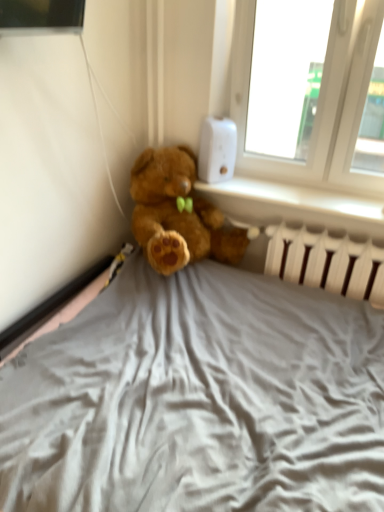
In order to face white plastic radiator at lower right, should I rotate leftwards or rightwards?

Rotate right and turn 17.614 degrees.

At what (x,y) coordinates should I click in order to perform the action: click on white plastic thermostat at upper right. Please return your answer as a coordinate pair (x, y). Looking at the image, I should click on (217, 150).

Is white plastic radiator at lower right beside white plastic thermostat at upper right?

No, white plastic radiator at lower right is not with white plastic thermostat at upper right.

Which of these two, white plastic radiator at lower right or white plastic thermostat at upper right, stands shorter?

white plastic thermostat at upper right.

Which object is positioned more to the left, white plastic radiator at lower right or white plastic thermostat at upper right?

Positioned to the left is white plastic thermostat at upper right.

Considering their positions, is white plastic radiator at lower right located in front of or behind white plastic thermostat at upper right?

Visually, white plastic radiator at lower right is located in front of white plastic thermostat at upper right.

From the image's perspective, who appears lower, white plastic thermostat at upper right or white plastic radiator at lower right?

white plastic radiator at lower right is shown below in the image.

From a real-world perspective, which is physically below, white plastic thermostat at upper right or white plastic radiator at lower right?

From a 3D spatial view, white plastic radiator at lower right is below.

Is white plastic thermostat at upper right next to white plastic radiator at lower right and touching it?

No, white plastic thermostat at upper right is not with white plastic radiator at lower right.

From a real-world perspective, is white plastic radiator at lower right positioned under white plastic radiator at lower right based on gravity?

Actually, white plastic radiator at lower right is physically above white plastic radiator at lower right in the real world.

From the picture: From the image's perspective, which object appears higher, white plastic radiator at lower right or white plastic radiator at lower right?

white plastic radiator at lower right is shown above in the image.

Which is in front, point (332, 194) or point (374, 293)?

The point (374, 293) is in front.

Is white plastic radiator at lower right facing away from white plastic radiator at lower right?

That's not correct — white plastic radiator at lower right is not looking away from white plastic radiator at lower right.

How much distance is there between white plastic radiator at lower right and white plastic radiator at lower right?

5.47 inches.

How many degrees apart are the facing directions of white plastic radiator at lower right and white plastic radiator at lower right?

There is a 0.000102-degree angle between the facing directions of white plastic radiator at lower right and white plastic radiator at lower right.

From a real-world perspective, is white plastic radiator at lower right above or below white plastic radiator at lower right?

white plastic radiator at lower right is situated lower than white plastic radiator at lower right in the real world.

Is white plastic radiator at lower right behind white plastic radiator at lower right?

No, the depth of white plastic radiator at lower right is less than that of white plastic radiator at lower right.

In order to click on window sill below the white plastic thermostat at upper right (from the image's perspective) in this screenshot , I will do `click(297, 207)`.

Is white plastic radiator at lower right behind white plastic thermostat at upper right?

No.

Considering the relative positions of white plastic radiator at lower right and white plastic thermostat at upper right in the image provided, is white plastic radiator at lower right to the left of white plastic thermostat at upper right from the viewer's perspective?

Incorrect, white plastic radiator at lower right is not on the left side of white plastic thermostat at upper right.

What's the angular difference between white plastic radiator at lower right and white plastic thermostat at upper right's facing directions?

The facing directions of white plastic radiator at lower right and white plastic thermostat at upper right are 58.3 degrees apart.

Considering the sizes of objects white plastic thermostat at upper right and white plastic radiator at lower right in the image provided, who is shorter, white plastic thermostat at upper right or white plastic radiator at lower right?

white plastic thermostat at upper right is shorter.

From a real-world perspective, which object stands above the other?

In real-world perspective, white plastic thermostat at upper right is above.

Considering the sizes of objects white plastic thermostat at upper right and white plastic radiator at lower right in the image provided, who is smaller, white plastic thermostat at upper right or white plastic radiator at lower right?

white plastic thermostat at upper right.

Is white plastic radiator at lower right at the back of white plastic thermostat at upper right?

white plastic thermostat at upper right is not turned away from white plastic radiator at lower right.

Identify the location of radiator on the right side of white plastic thermostat at upper right. This screenshot has height=512, width=384. (326, 262).

At what (x,y) coordinates should I click in order to perform the action: click on thermostat that appears above the white plastic radiator at lower right (from a real-world perspective). Please return your answer as a coordinate pair (x, y). The width and height of the screenshot is (384, 512). Looking at the image, I should click on (217, 150).

Which object lies further to the anchor point white plastic radiator at lower right, white plastic radiator at lower right or white plastic thermostat at upper right?

Among the two, white plastic thermostat at upper right is located further to white plastic radiator at lower right.

Estimate the real-world distances between objects in this image. Which object is closer to white plastic thermostat at upper right, white plastic radiator at lower right or white plastic radiator at lower right?

Based on the image, white plastic radiator at lower right appears to be nearer to white plastic thermostat at upper right.

From the image, which object appears to be nearer to white plastic thermostat at upper right, white plastic radiator at lower right or white plastic radiator at lower right?

white plastic radiator at lower right is closer to white plastic thermostat at upper right.

Based on their spatial positions, is white plastic thermostat at upper right or white plastic radiator at lower right closer to white plastic radiator at lower right?

white plastic radiator at lower right.

Looking at the image, which one is located closer to white plastic radiator at lower right, white plastic thermostat at upper right or white plastic radiator at lower right?

white plastic radiator at lower right is positioned closer to the anchor white plastic radiator at lower right.

Considering their positions, is white plastic radiator at lower right positioned further to white plastic radiator at lower right than white plastic thermostat at upper right?

Based on the image, white plastic thermostat at upper right appears to be further to white plastic radiator at lower right.

Locate an element on the screen. The width and height of the screenshot is (384, 512). window sill between white plastic thermostat at upper right and white plastic radiator at lower right from top to bottom is located at coordinates (297, 207).